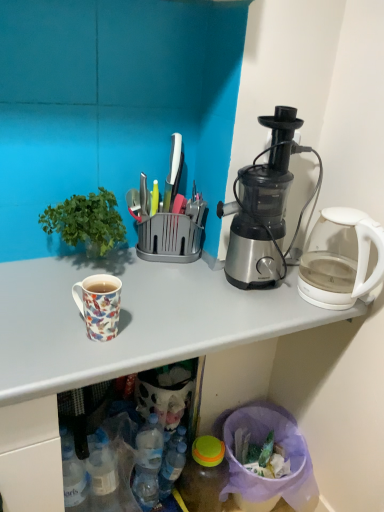
Find the location of a particular element. The width and height of the screenshot is (384, 512). vacant point to the left of floral ceramic mug at left is located at coordinates (40, 320).